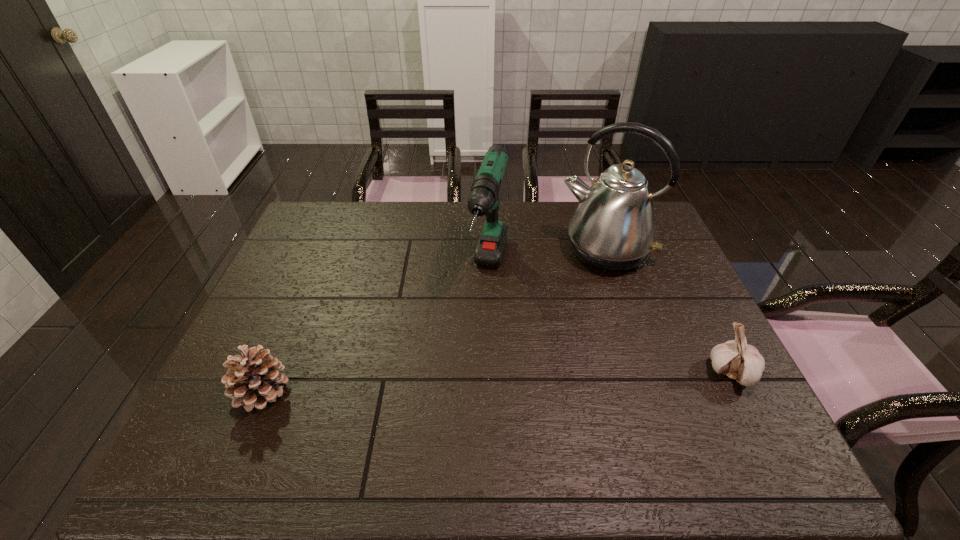
Locate an element on the screen. object located in the near left corner section of the desktop is located at coordinates (253, 380).

Identify the location of object that is at the far right corner. (613, 229).

Locate an element on the screen. object that is at the near right corner is located at coordinates (736, 359).

At what (x,y) coordinates should I click in order to perform the action: click on vacant area at the far edge. Please return your answer as a coordinate pair (x, y). Looking at the image, I should click on (441, 228).

Identify the location of free space at the right edge of the desktop. The image size is (960, 540). (662, 255).

I want to click on free spot between the second tallest object and the leftmost object, so pyautogui.click(x=375, y=332).

Locate an element on the screen. free space between the drill and the garlic is located at coordinates (611, 323).

Where is `free space between the garlic and the second object from left to right`? The width and height of the screenshot is (960, 540). free space between the garlic and the second object from left to right is located at coordinates (611, 323).

Locate an element on the screen. The height and width of the screenshot is (540, 960). free space between the kettle and the pinecone is located at coordinates (434, 321).

This screenshot has width=960, height=540. I want to click on free space between the garlic and the third object from right to left, so click(x=611, y=323).